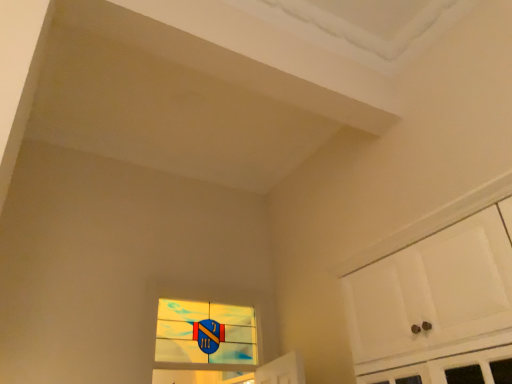
Image resolution: width=512 pixels, height=384 pixels. Find the location of `stained glass window at center`. stained glass window at center is located at coordinates (205, 342).

Image resolution: width=512 pixels, height=384 pixels. What do you see at coordinates (205, 342) in the screenshot?
I see `stained glass window at center` at bounding box center [205, 342].

Measure the distance between stained glass window at center and camera.

stained glass window at center is 8.93 feet from camera.

This screenshot has height=384, width=512. Identify the location of stained glass window at center. (205, 342).